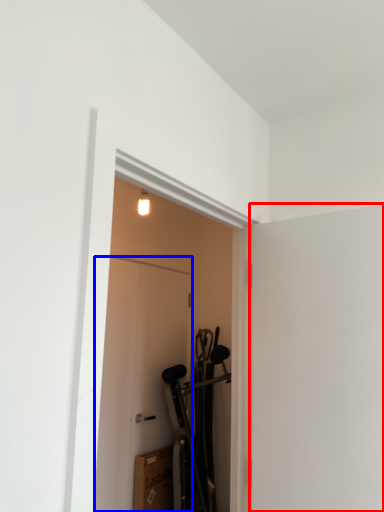
Question: Among these objects, which one is nearest to the camera, screen door (highlighted by a red box) or door (highlighted by a blue box)?

Choices:
 (A) screen door
 (B) door

Answer: (A)